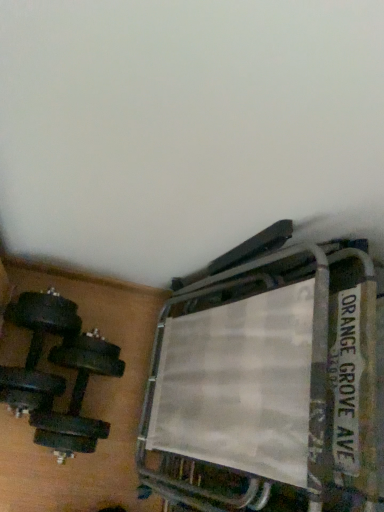
Find the location of a particular element. The image size is (384, 512). black rubber dumbbell at lower left is located at coordinates (37, 349).

Measure the distance between black rubber dumbbell at lower left and camera.

black rubber dumbbell at lower left and camera are 3.47 feet apart.

Image resolution: width=384 pixels, height=512 pixels. Describe the element at coordinates (37, 349) in the screenshot. I see `black rubber dumbbell at lower left` at that location.

This screenshot has width=384, height=512. What do you see at coordinates (267, 378) in the screenshot?
I see `metallic silver bunk bed at upper right` at bounding box center [267, 378].

Find the location of a particular element. Image resolution: width=384 pixels, height=512 pixels. metallic silver bunk bed at upper right is located at coordinates (267, 378).

Image resolution: width=384 pixels, height=512 pixels. Identify the location of black rubber dumbbell at lower left. (37, 349).

Is black rubber dumbbell at lower left to the left of metallic silver bunk bed at upper right from the viewer's perspective?

Yes, black rubber dumbbell at lower left is to the left of metallic silver bunk bed at upper right.

In the image, is black rubber dumbbell at lower left positioned in front of or behind metallic silver bunk bed at upper right?

In the image, black rubber dumbbell at lower left appears behind metallic silver bunk bed at upper right.

Considering the positions of point (58, 395) and point (336, 315), is point (58, 395) closer or farther from the camera than point (336, 315)?

Point (58, 395) is farther from the camera than point (336, 315).

From the image's perspective, which object appears higher, black rubber dumbbell at lower left or metallic silver bunk bed at upper right?

metallic silver bunk bed at upper right appears higher in the image.

Looking at this image, from a real-world perspective, is black rubber dumbbell at lower left located higher than metallic silver bunk bed at upper right?

No, from a real-world perspective, black rubber dumbbell at lower left is not on top of metallic silver bunk bed at upper right.

Can you confirm if black rubber dumbbell at lower left is wider than metallic silver bunk bed at upper right?

Yes.

Between black rubber dumbbell at lower left and metallic silver bunk bed at upper right, which one has less height?

Standing shorter between the two is black rubber dumbbell at lower left.

Considering the sizes of objects black rubber dumbbell at lower left and metallic silver bunk bed at upper right in the image provided, who is bigger, black rubber dumbbell at lower left or metallic silver bunk bed at upper right?

metallic silver bunk bed at upper right.

Is black rubber dumbbell at lower left situated inside metallic silver bunk bed at upper right or outside?

black rubber dumbbell at lower left is not inside metallic silver bunk bed at upper right, it's outside.

Would you say black rubber dumbbell at lower left is a long distance from metallic silver bunk bed at upper right?

They are positioned close to each other.

Could you tell me if black rubber dumbbell at lower left is facing metallic silver bunk bed at upper right?

No, black rubber dumbbell at lower left is not oriented towards metallic silver bunk bed at upper right.

How many degrees apart are the facing directions of black rubber dumbbell at lower left and metallic silver bunk bed at upper right?

The angle between the facing direction of black rubber dumbbell at lower left and the facing direction of metallic silver bunk bed at upper right is 88.9 degrees.

Measure the distance from black rubber dumbbell at lower left to metallic silver bunk bed at upper right.

black rubber dumbbell at lower left is 18.35 inches from metallic silver bunk bed at upper right.

Find the location of a particular element. The height and width of the screenshot is (512, 384). bunk bed in front of the black rubber dumbbell at lower left is located at coordinates (267, 378).

Considering the relative positions of metallic silver bunk bed at upper right and black rubber dumbbell at lower left in the image provided, is metallic silver bunk bed at upper right to the right of black rubber dumbbell at lower left from the viewer's perspective?

Correct, you'll find metallic silver bunk bed at upper right to the right of black rubber dumbbell at lower left.

Which is behind, metallic silver bunk bed at upper right or black rubber dumbbell at lower left?

black rubber dumbbell at lower left is further away from the camera.

Is point (221, 256) closer or farther from the camera than point (11, 389)?

Point (221, 256) is positioned closer to the camera compared to point (11, 389).

From the image's perspective, between metallic silver bunk bed at upper right and black rubber dumbbell at lower left, who is located below?

black rubber dumbbell at lower left appears lower in the image.

From a real-world perspective, which object stands above the other?

metallic silver bunk bed at upper right, from a real-world perspective.

Looking at their sizes, would you say metallic silver bunk bed at upper right is wider or thinner than black rubber dumbbell at lower left?

metallic silver bunk bed at upper right is thinner than black rubber dumbbell at lower left.

Considering the relative sizes of metallic silver bunk bed at upper right and black rubber dumbbell at lower left in the image provided, is metallic silver bunk bed at upper right taller than black rubber dumbbell at lower left?

Yes.

Who is smaller, metallic silver bunk bed at upper right or black rubber dumbbell at lower left?

black rubber dumbbell at lower left is smaller.

Is black rubber dumbbell at lower left inside metallic silver bunk bed at upper right?

Result: Definitely not — black rubber dumbbell at lower left is not inside metallic silver bunk bed at upper right.

Is metallic silver bunk bed at upper right far from black rubber dumbbell at lower left?

That's not correct — metallic silver bunk bed at upper right is a little close to black rubber dumbbell at lower left.

Could you tell me if metallic silver bunk bed at upper right is turned towards black rubber dumbbell at lower left?

Yes, metallic silver bunk bed at upper right is aimed at black rubber dumbbell at lower left.

How many degrees apart are the facing directions of metallic silver bunk bed at upper right and black rubber dumbbell at lower left?

88.9 degrees separate the facing orientations of metallic silver bunk bed at upper right and black rubber dumbbell at lower left.

Where is `bunk bed above the black rubber dumbbell at lower left (from a real-world perspective)`? This screenshot has height=512, width=384. bunk bed above the black rubber dumbbell at lower left (from a real-world perspective) is located at coordinates (267, 378).

Locate an element on the screen. dumbbell below the metallic silver bunk bed at upper right (from a real-world perspective) is located at coordinates (37, 349).

Locate an element on the screen. The width and height of the screenshot is (384, 512). bunk bed lying above the black rubber dumbbell at lower left (from the image's perspective) is located at coordinates coord(267,378).